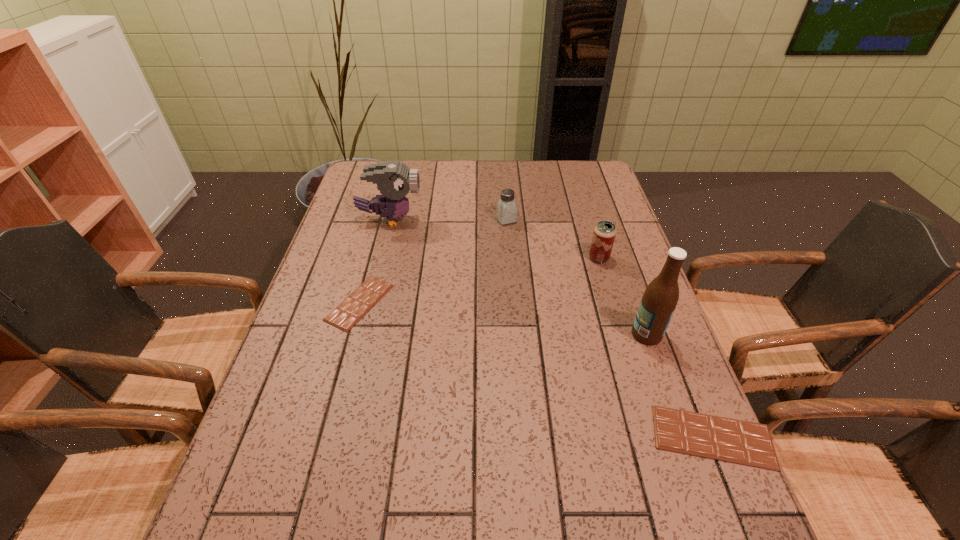
The image size is (960, 540). Identify the location of blank area in the image that satisfies the following two spatial constraints: 1. at the beak of the fifth shortest object; 2. on the left side of the taller chocolate bar. (335, 437).

Identify the location of free space in the image that satisfies the following two spatial constraints: 1. on the front side of the fifth tallest object; 2. on the left side of the beer bottle. (684, 437).

I want to click on vacant space that satisfies the following two spatial constraints: 1. at the beak of the second tallest object; 2. on the back side of the beer can, so click(x=380, y=258).

The height and width of the screenshot is (540, 960). What are the coordinates of `vacant space that satisfies the following two spatial constraints: 1. at the beak of the tallest object; 2. on the right side of the fifth shortest object` in the screenshot? It's located at (361, 334).

Locate an element on the screen. free space that satisfies the following two spatial constraints: 1. at the beak of the second tallest object; 2. on the back side of the nearest object is located at coordinates (335, 437).